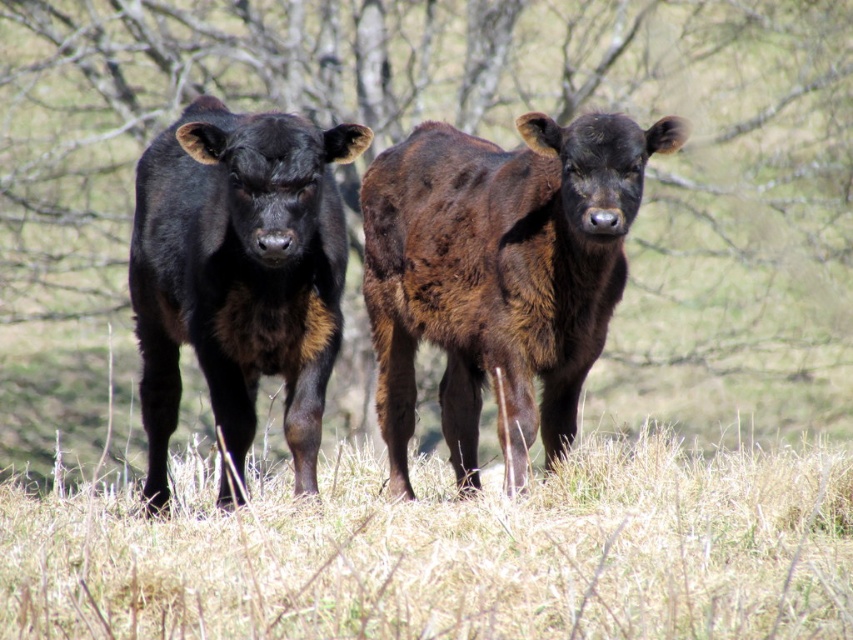
You are a farmer who wants to identify the larger animal between the shiny brown calf at center and the black glossy cow at center in the field. Based on the scene, which one is bigger?

The shiny brown calf at center is larger compared to the black glossy cow at center, so the shiny brown calf at center is the bigger one.

You are a photographer aiming to capture a closeup of the black glossy cow at center without the dry grass at lower center appearing in the shot. What adjustment should you make to your camera angle?

Move the camera to the left so that the dry grass at lower center is no longer in the frame. Since the dry grass at lower center is to the right of the black glossy cow at center, shifting the angle to the left will exclude it while keeping the cow centered.